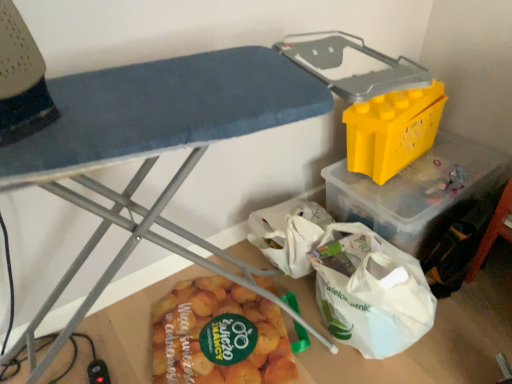
Question: Is yellow matte potato at lower center spatially inside yellow plastic storage bin at upper right, or outside of it?

Choices:
 (A) inside
 (B) outside

Answer: (A)

Question: In the image, is yellow matte potato at lower center on the left side or the right side of yellow plastic storage bin at upper right?

Choices:
 (A) left
 (B) right

Answer: (B)

Question: Which is nearer to the yellow matte potato at lower center?

Choices:
 (A) yellow plastic storage bin at upper right
 (B) yellow plastic container at upper right

Answer: (A)

Question: Which of these objects is positioned farthest from the yellow plastic container at upper right?

Choices:
 (A) yellow plastic storage bin at upper right
 (B) yellow matte potato at lower center

Answer: (A)